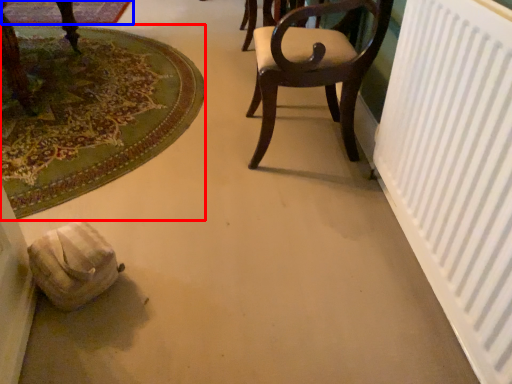
Question: Which object is closer to the camera taking this photo, mat (highlighted by a red box) or mat (highlighted by a blue box)?

Choices:
 (A) mat
 (B) mat

Answer: (A)